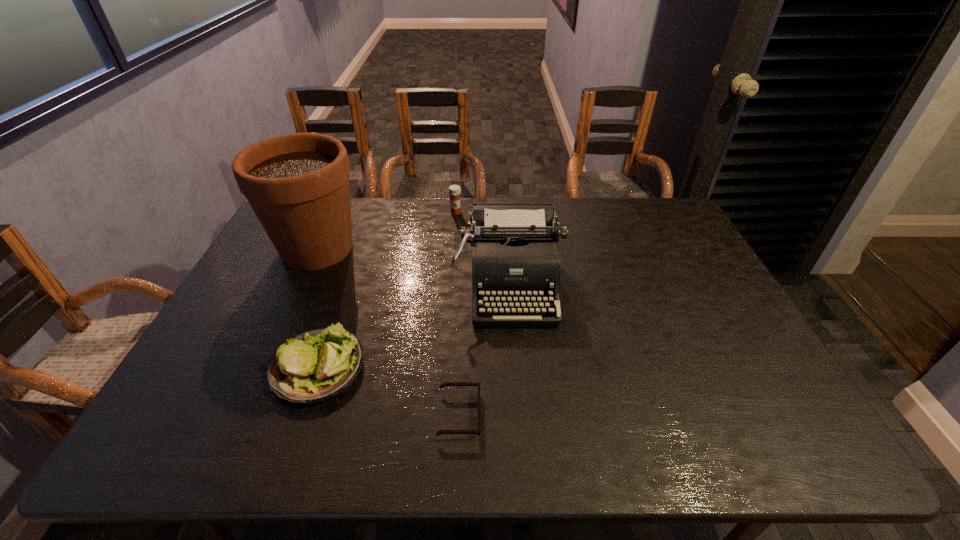
Identify the location of object that stands as the second closest to the fourth tallest object. This screenshot has height=540, width=960. (515, 259).